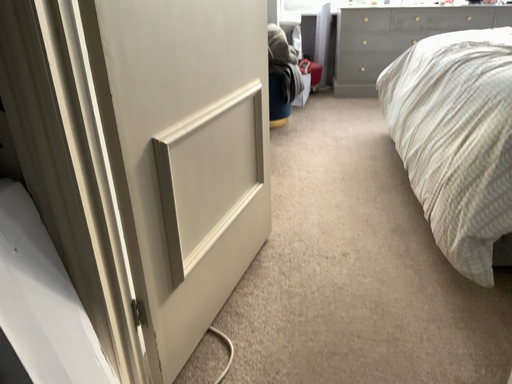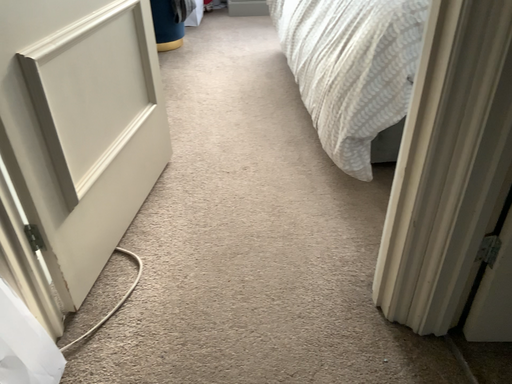
Question: How did the camera likely rotate when shooting the video?

Choices:
 (A) rotated upward
 (B) rotated downward

Answer: (B)